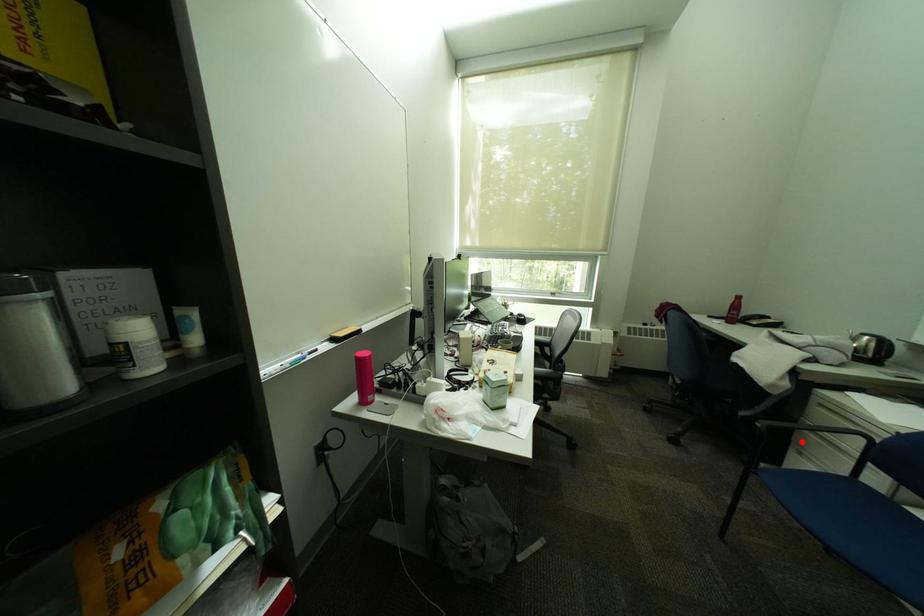
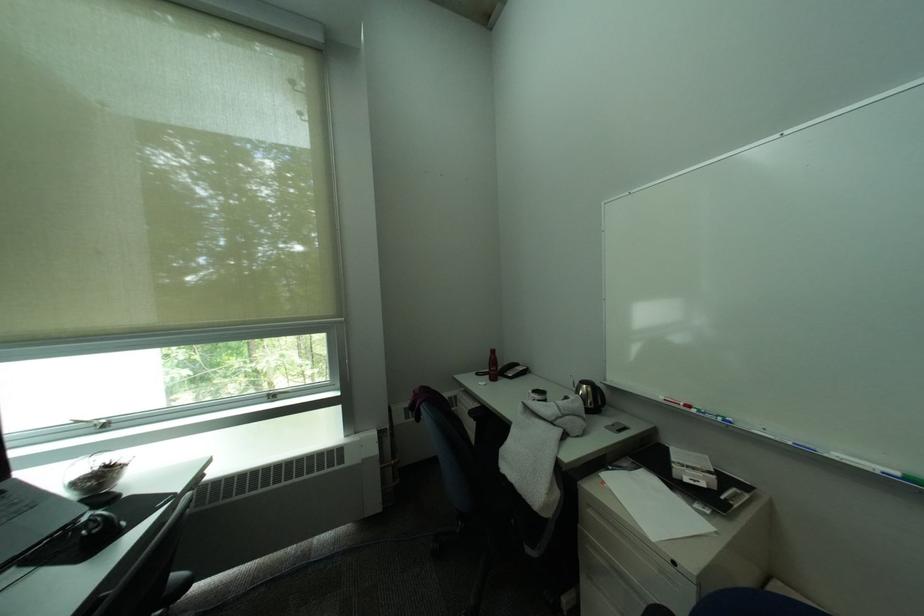
Question: I am providing you with two images of the same scene from different viewpoints. In image1, a red point is highlighted. Considering the same 3D point in image2, which of the following is correct?

Choices:
 (A) It is closer
 (B) It is farther

Answer: (A)